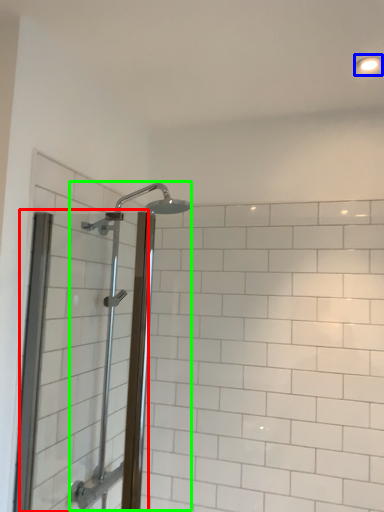
Question: Which object is positioned farthest from screen door (highlighted by a red box)? Select from light fixture (highlighted by a blue box) and shower (highlighted by a green box).

Choices:
 (A) light fixture
 (B) shower

Answer: (A)